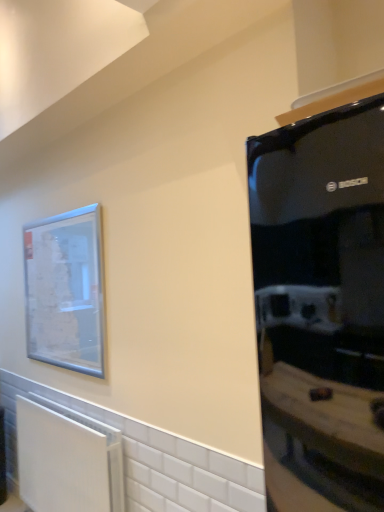
Question: Is the surface of clear glass picture frame at upper left in direct contact with black glossy refrigerator at right?

Choices:
 (A) yes
 (B) no

Answer: (B)

Question: Can you confirm if clear glass picture frame at upper left is wider than black glossy refrigerator at right?

Choices:
 (A) yes
 (B) no

Answer: (B)

Question: Would you say black glossy refrigerator at right is part of clear glass picture frame at upper left's contents?

Choices:
 (A) no
 (B) yes

Answer: (A)

Question: Is clear glass picture frame at upper left closer to camera compared to black glossy refrigerator at right?

Choices:
 (A) yes
 (B) no

Answer: (B)

Question: Is clear glass picture frame at upper left far away from black glossy refrigerator at right?

Choices:
 (A) no
 (B) yes

Answer: (B)

Question: Would you say black glossy refrigerator at right is inside or outside white matte radiator at lower left?

Choices:
 (A) inside
 (B) outside

Answer: (B)

Question: Considering the positions of black glossy refrigerator at right and white matte radiator at lower left in the image, is black glossy refrigerator at right taller or shorter than white matte radiator at lower left?

Choices:
 (A) tall
 (B) short

Answer: (A)

Question: Considering their positions, is black glossy refrigerator at right located in front of or behind white matte radiator at lower left?

Choices:
 (A) front
 (B) behind

Answer: (A)

Question: From the image's perspective, is black glossy refrigerator at right positioned above or below white matte radiator at lower left?

Choices:
 (A) below
 (B) above

Answer: (B)

Question: From a real-world perspective, is black glossy refrigerator at right physically located above or below clear glass picture frame at upper left?

Choices:
 (A) below
 (B) above

Answer: (A)

Question: Is black glossy refrigerator at right in front of or behind clear glass picture frame at upper left in the image?

Choices:
 (A) behind
 (B) front

Answer: (B)

Question: From the image's perspective, relative to clear glass picture frame at upper left, is black glossy refrigerator at right above or below?

Choices:
 (A) below
 (B) above

Answer: (A)

Question: Is black glossy refrigerator at right bigger or smaller than clear glass picture frame at upper left?

Choices:
 (A) big
 (B) small

Answer: (A)

Question: Would you say white matte radiator at lower left is to the left or to the right of clear glass picture frame at upper left in the picture?

Choices:
 (A) right
 (B) left

Answer: (A)

Question: Considering the positions of white matte radiator at lower left and clear glass picture frame at upper left in the image, is white matte radiator at lower left wider or thinner than clear glass picture frame at upper left?

Choices:
 (A) wide
 (B) thin

Answer: (A)